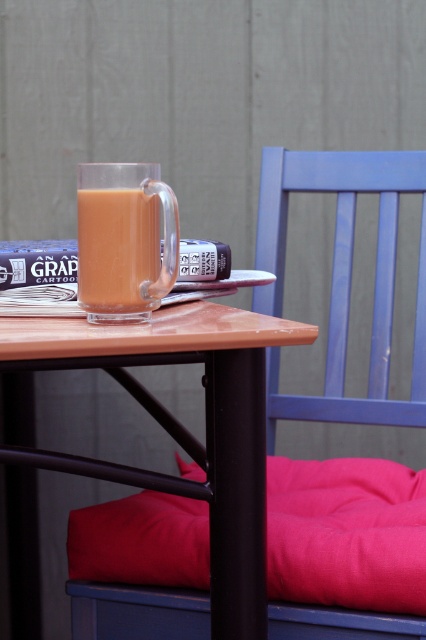
You are sitting at the table and want to move your hand from the velvety pink pillow at lower right to the matte blue chair at center. Which direction should you move your hand?

You should move your hand to the right because the velvety pink pillow at lower right is to the left of the matte blue chair at center.

You are standing in the center of the image. Which direction should you move to reach the matte blue chair at center?

The matte blue chair at center is located at point coordinates of (342, 278), so you should move towards the right direction to reach it.